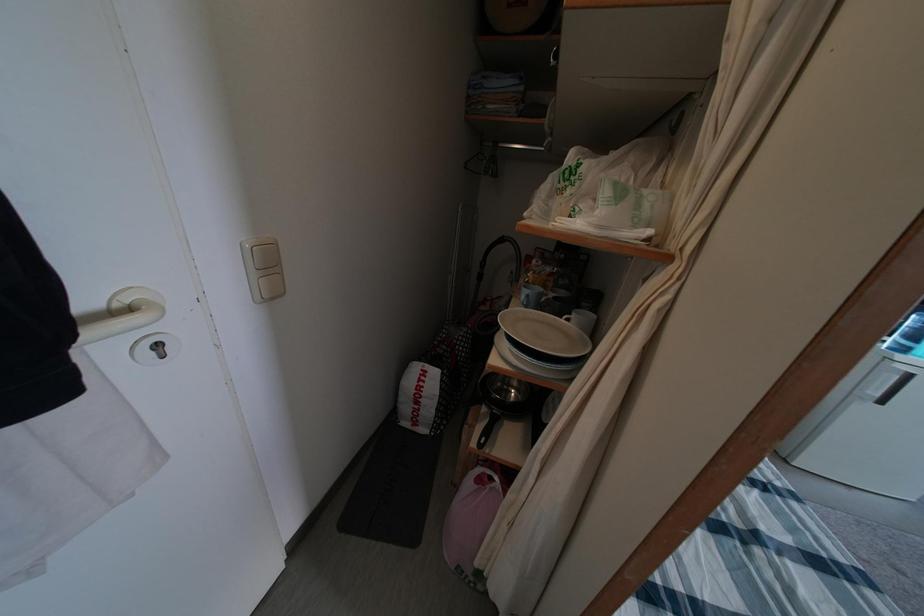
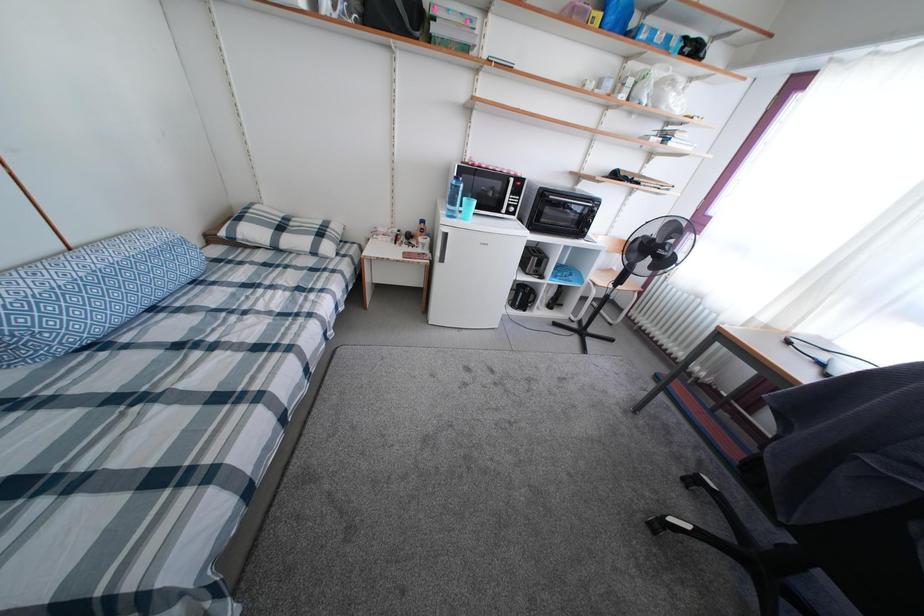
Question: The images are taken continuously from a first-person perspective. In which direction are you moving?

Choices:
 (A) Left
 (B) Right
 (C) Forward
 (D) Backward

Answer: (B)